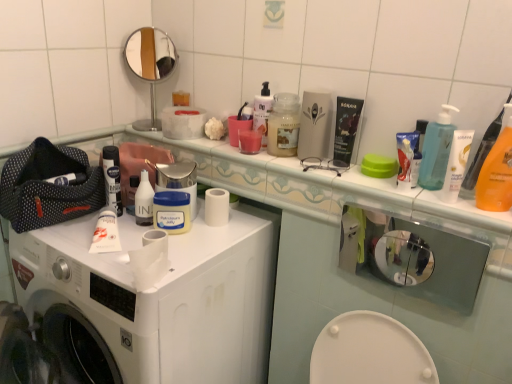
The height and width of the screenshot is (384, 512). Identify the location of vacant space to the right of metallic silver glasses at upper center. (375, 181).